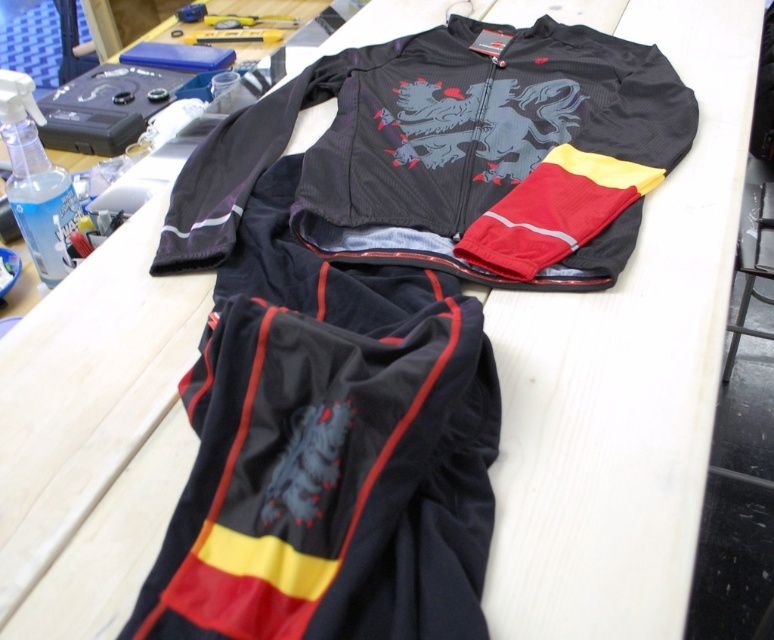
Is black matte cycling suit at center smaller than matte black jacket at center?

Indeed, black matte cycling suit at center has a smaller size compared to matte black jacket at center.

Between point (152, 612) and point (365, 84), which one is positioned behind?

Point (365, 84)

Find the location of a particular element. black matte cycling suit at center is located at coordinates (329, 451).